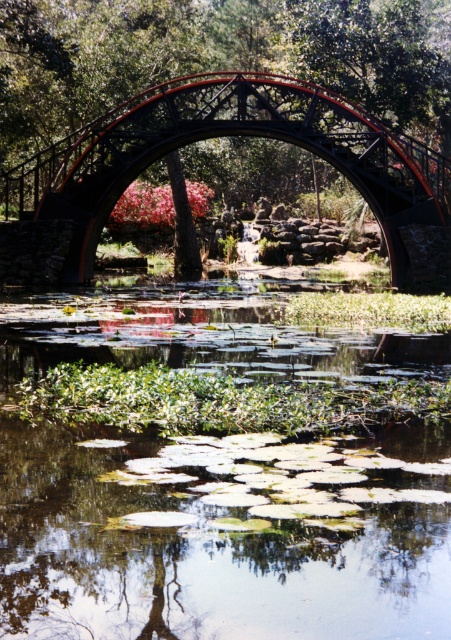
Question: Which of the following is the farthest from the observer?

Choices:
 (A) black metal bridge at center
 (B) green leafy water at center

Answer: (A)

Question: From the image, what is the correct spatial relationship of green leafy water at center in relation to black metal bridge at center?

Choices:
 (A) below
 (B) above

Answer: (A)

Question: Can you confirm if green leafy water at center is smaller than black metal bridge at center?

Choices:
 (A) no
 (B) yes

Answer: (B)

Question: Among these objects, which one is nearest to the camera?

Choices:
 (A) black metal bridge at center
 (B) green leafy water at center

Answer: (B)

Question: Can you confirm if green leafy water at center is thinner than black metal bridge at center?

Choices:
 (A) no
 (B) yes

Answer: (B)